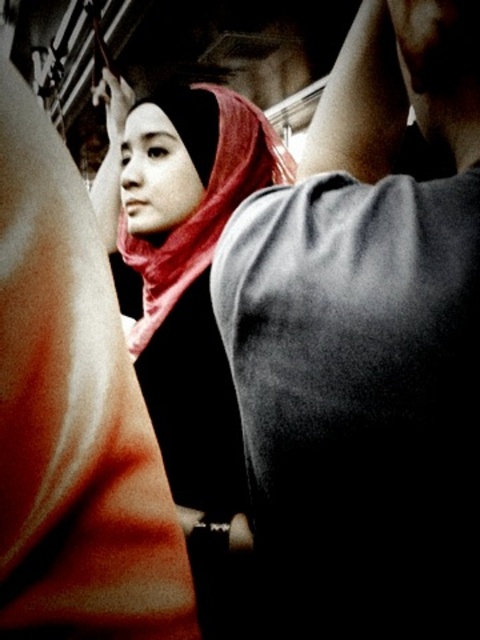
Looking at this image, can you confirm if gray matte shirt at upper right is smaller than matte red scarf at center?

Yes, gray matte shirt at upper right is smaller than matte red scarf at center.

Who is positioned more to the left, gray matte shirt at upper right or matte red scarf at center?

From the viewer's perspective, matte red scarf at center appears more on the left side.

What are the coordinates of `gray matte shirt at upper right` in the screenshot? It's located at coord(367,342).

This screenshot has height=640, width=480. I want to click on gray matte shirt at upper right, so click(x=367, y=342).